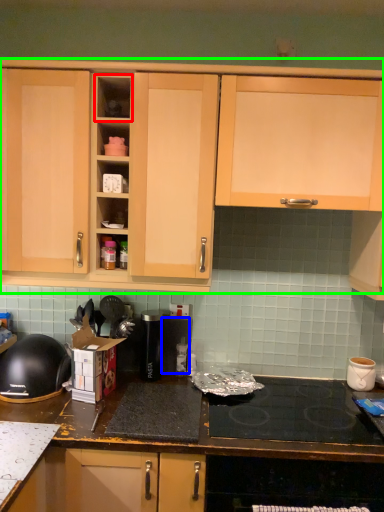
Question: Which object is the closest to the shelf (highlighted by a red box)? Choose among these: appliance (highlighted by a blue box) or cabinetry (highlighted by a green box).

Choices:
 (A) appliance
 (B) cabinetry

Answer: (B)